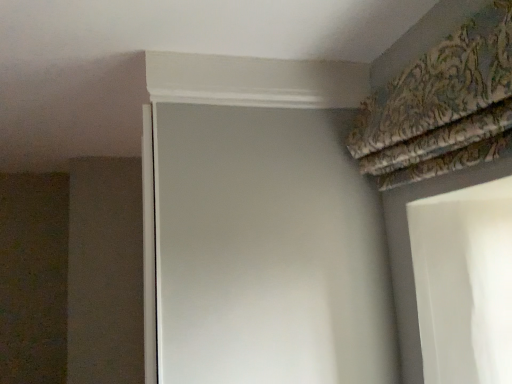
This screenshot has width=512, height=384. What do you see at coordinates (267, 250) in the screenshot?
I see `white glossy screen door at upper center` at bounding box center [267, 250].

What is the approximate width of white glossy screen door at upper center?

white glossy screen door at upper center is 27.45 inches in width.

At what (x,y) coordinates should I click in order to perform the action: click on white glossy screen door at upper center. Please return your answer as a coordinate pair (x, y). The height and width of the screenshot is (384, 512). Looking at the image, I should click on (267, 250).

The image size is (512, 384). In order to click on white glossy screen door at upper center in this screenshot , I will do `click(267, 250)`.